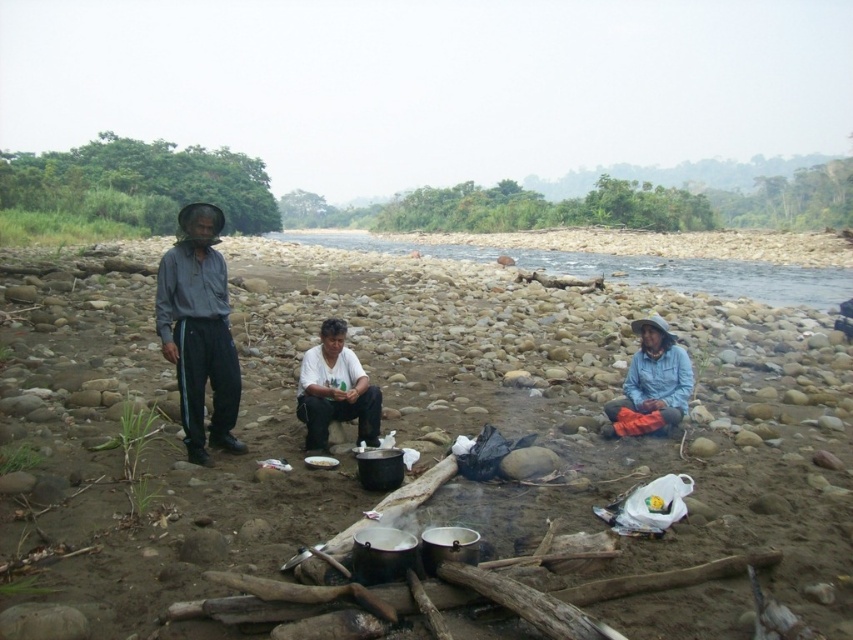
Question: Estimate the real-world distances between objects in this image. Which object is farther from the blue denim jacket at lower right?

Choices:
 (A) white matte shirt at center
 (B) gray fabric shirt at left

Answer: (B)

Question: Does white matte shirt at center appear under blue denim jacket at lower right?

Choices:
 (A) no
 (B) yes

Answer: (A)

Question: Is the position of gray fabric shirt at left more distant than that of blue denim jacket at lower right?

Choices:
 (A) no
 (B) yes

Answer: (A)

Question: Is white matte shirt at center to the right of blue denim jacket at lower right from the viewer's perspective?

Choices:
 (A) yes
 (B) no

Answer: (B)

Question: Which is nearer to the gray fabric shirt at left?

Choices:
 (A) blue denim jacket at lower right
 (B) white matte shirt at center

Answer: (B)

Question: Which object is farther from the camera taking this photo?

Choices:
 (A) gray fabric shirt at left
 (B) white matte shirt at center
 (C) blue denim jacket at lower right

Answer: (C)